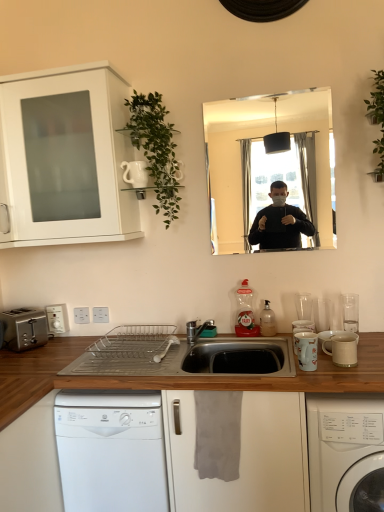
The image size is (384, 512). Identify the location of white plastic dishwasher at lower center. (111, 450).

Describe the element at coordinates (342, 349) in the screenshot. Image resolution: width=384 pixels, height=512 pixels. I see `white ceramic mug at right, the first appliance positioned from the right` at that location.

What do you see at coordinates (346, 452) in the screenshot?
I see `white glossy washing machine at lower right` at bounding box center [346, 452].

The height and width of the screenshot is (512, 384). Describe the element at coordinates (184, 376) in the screenshot. I see `wooden countertop at center, arranged as the 1th countertop when viewed from the top` at that location.

This screenshot has height=512, width=384. What are the coordinates of `clear glass mirror at upper center` in the screenshot? It's located at (268, 169).

Where is `white glossy cabinet at upper left`? The image size is (384, 512). white glossy cabinet at upper left is located at coordinates pos(65,158).

You are a GUI agent. You are given a task and a screenshot of the screen. Output one action in this format:
    pyautogui.click(x=<x>, y=<y>)
    Task: Click on the translucent plastic bottle at sink, the second bottle when ordered from right to left
    The width and height of the screenshot is (384, 512).
    Given the screenshot: What is the action you would take?
    pyautogui.click(x=245, y=312)

Locate an element on the screen. white plastic dishwasher at lower center is located at coordinates (111, 450).

Considering the positions of objects wooden countertop at center, arranged as the 1th countertop when viewed from the top, and white ceramic mug at right, which is the 2th appliance in front-to-back order, in the image provided, who is more to the right, wooden countertop at center, arranged as the 1th countertop when viewed from the top, or white ceramic mug at right, which is the 2th appliance in front-to-back order,?

white ceramic mug at right, which is the 2th appliance in front-to-back order, is more to the right.

From the picture: From the image's perspective, is wooden countertop at center, the 2th countertop ordered from the bottom, located above white ceramic mug at right, arranged as the 3th appliance when viewed from the top?

Incorrect, from the image's perspective, wooden countertop at center, the 2th countertop ordered from the bottom, is lower than white ceramic mug at right, arranged as the 3th appliance when viewed from the top.

Is wooden countertop at center, the 2th countertop ordered from the bottom, located outside white ceramic mug at right, the 3th appliance viewed from the left?

Yes, wooden countertop at center, the 2th countertop ordered from the bottom, is located beyond the bounds of white ceramic mug at right, the 3th appliance viewed from the left.

How much distance is there between wooden countertop at center, the 2th countertop ordered from the bottom, and translucent plastic bottle at sink, marked as the 1th bottle in a left-to-right arrangement?

26.27 inches.

From the picture: From the image's perspective, is wooden countertop at center, the 2th countertop ordered from the bottom, located above or below translucent plastic bottle at sink, the second bottle when ordered from right to left?

wooden countertop at center, the 2th countertop ordered from the bottom, is situated lower than translucent plastic bottle at sink, the second bottle when ordered from right to left, in the image.

Which object is closer to the camera, wooden countertop at center, the 2th countertop ordered from the bottom, or translucent plastic bottle at sink, marked as the 1th bottle in a left-to-right arrangement?

wooden countertop at center, the 2th countertop ordered from the bottom, is closer to the camera.

Would you consider wooden countertop at center, arranged as the 1th countertop when viewed from the top, to be distant from translucent plastic bottle at sink, marked as the 1th bottle in a left-to-right arrangement?

wooden countertop at center, arranged as the 1th countertop when viewed from the top, is near translucent plastic bottle at sink, marked as the 1th bottle in a left-to-right arrangement, not far away.

Who is bigger, white ceramic pitcher at upper left, placed as the first appliance when sorted from left to right, or white glossy mug at right, which appears as the 2th appliance when viewed from the right?

With larger size is white ceramic pitcher at upper left, placed as the first appliance when sorted from left to right.

Where is `appliance that appears above the white glossy mug at right, arranged as the second appliance when viewed from the top (from the image's perspective)`? The width and height of the screenshot is (384, 512). appliance that appears above the white glossy mug at right, arranged as the second appliance when viewed from the top (from the image's perspective) is located at coordinates (135, 173).

Does white plastic dishwasher at lower center lie behind translucent plastic soap dispenser at sink, which is counted as the 1th bottle, starting from the right?

No, white plastic dishwasher at lower center is closer to the viewer.

At what (x,y) coordinates should I click in order to perform the action: click on bottle that is the 1st one above the white plastic dishwasher at lower center (from a real-world perspective). Please return your answer as a coordinate pair (x, y). The width and height of the screenshot is (384, 512). Looking at the image, I should click on (267, 320).

Visually, is white plastic dishwasher at lower center positioned to the left or to the right of translucent plastic soap dispenser at sink, which is the 2th bottle from left to right?

white plastic dishwasher at lower center is to the left of translucent plastic soap dispenser at sink, which is the 2th bottle from left to right.

Considering the relative sizes of wooden at lower center, which ranks as the 1th countertop in bottom-to-top order, and white plastic dishwasher at lower center in the image provided, is wooden at lower center, which ranks as the 1th countertop in bottom-to-top order, taller than white plastic dishwasher at lower center?

Correct, wooden at lower center, which ranks as the 1th countertop in bottom-to-top order, is much taller as white plastic dishwasher at lower center.

Is white plastic dishwasher at lower center at the back of wooden at lower center, which ranks as the 1th countertop in bottom-to-top order?

Yes.

Considering the relative positions of wooden at lower center, the second countertop viewed from the top, and white plastic dishwasher at lower center in the image provided, is wooden at lower center, the second countertop viewed from the top, to the right of white plastic dishwasher at lower center from the viewer's perspective?

Correct, you'll find wooden at lower center, the second countertop viewed from the top, to the right of white plastic dishwasher at lower center.

Considering the relative positions of white ceramic pitcher at upper left, positioned as the third appliance in bottom-to-top order, and green leafy plant at upper left in the image provided, is white ceramic pitcher at upper left, positioned as the third appliance in bottom-to-top order, to the left of green leafy plant at upper left from the viewer's perspective?

Correct, you'll find white ceramic pitcher at upper left, positioned as the third appliance in bottom-to-top order, to the left of green leafy plant at upper left.

Looking at their sizes, would you say white ceramic pitcher at upper left, arranged as the third appliance when viewed from the right, is wider or thinner than green leafy plant at upper left?

Clearly, white ceramic pitcher at upper left, arranged as the third appliance when viewed from the right, has less width compared to green leafy plant at upper left.

Is white ceramic pitcher at upper left, arranged as the third appliance when viewed from the right, inside the boundaries of green leafy plant at upper left, or outside?

white ceramic pitcher at upper left, arranged as the third appliance when viewed from the right, can be found inside green leafy plant at upper left.

Considering the relative positions of white ceramic pitcher at upper left, arranged as the third appliance when viewed from the right, and green leafy plant at upper left in the image provided, is white ceramic pitcher at upper left, arranged as the third appliance when viewed from the right, in front of green leafy plant at upper left?

No, white ceramic pitcher at upper left, arranged as the third appliance when viewed from the right, is further to the viewer.

Considering the relative positions of silver metallic toaster at lower left and clear glass mirror at upper center in the image provided, is silver metallic toaster at lower left to the left of clear glass mirror at upper center from the viewer's perspective?

Indeed, silver metallic toaster at lower left is positioned on the left side of clear glass mirror at upper center.

Is silver metallic toaster at lower left far away from clear glass mirror at upper center?

Yes.

Could you tell me if silver metallic toaster at lower left is facing clear glass mirror at upper center?

No, silver metallic toaster at lower left is not facing towards clear glass mirror at upper center.

Considering the relative sizes of silver metallic toaster at lower left and clear glass mirror at upper center in the image provided, is silver metallic toaster at lower left thinner than clear glass mirror at upper center?

No, silver metallic toaster at lower left is not thinner than clear glass mirror at upper center.

There is a wooden countertop at center, the 2th countertop ordered from the bottom. Where is `the 1st appliance above it (from the image's perspective)`? the 1st appliance above it (from the image's perspective) is located at coordinates (342, 349).

This screenshot has height=512, width=384. I want to click on the 1st bottle to the right of the wooden countertop at center, the 2th countertop ordered from the bottom, starting your count from the anchor, so click(245, 312).

Estimate the real-world distances between objects in this image. Which object is further from white ceramic pitcher at upper left, placed as the first appliance when sorted from left to right, translucent plastic soap dispenser at sink, which is the 2th bottle from left to right, or white glossy cabinet at upper left?

translucent plastic soap dispenser at sink, which is the 2th bottle from left to right, lies further to white ceramic pitcher at upper left, placed as the first appliance when sorted from left to right, than the other object.

Considering their positions, is white glossy mug at right, the first appliance viewed from the front, positioned further to green leafy plant at upper left than white glossy washing machine at lower right?

white glossy washing machine at lower right is further to green leafy plant at upper left.

Which object lies nearer to the anchor point white ceramic pitcher at upper left, arranged as the 1th appliance when viewed from the top, white plastic dishwasher at lower center or white glossy cabinet at upper left?

white glossy cabinet at upper left lies closer to white ceramic pitcher at upper left, arranged as the 1th appliance when viewed from the top, than the other object.

Looking at the image, which one is located closer to translucent plastic soap dispenser at sink, which is counted as the 1th bottle, starting from the right, silver metallic toaster at lower left or white glossy cabinet at upper left?

white glossy cabinet at upper left.

In the scene shown: Which object lies further to the anchor point white glossy mug at right, which appears as the 2th appliance when viewed from the right, green leafy plant at upper left or silver metallic toaster at lower left?

silver metallic toaster at lower left is further to white glossy mug at right, which appears as the 2th appliance when viewed from the right.

Considering their positions, is white plastic dishwasher at lower center positioned closer to translucent plastic bottle at sink, the second bottle when ordered from right to left, than clear glass mirror at upper center?

The object closer to translucent plastic bottle at sink, the second bottle when ordered from right to left, is white plastic dishwasher at lower center.

When comparing their distances from green leafy plant at upper left, does wooden at lower center, which ranks as the 1th countertop in bottom-to-top order, or white ceramic mug at right, arranged as the 3th appliance when viewed from the top, seem closer?

Among the two, wooden at lower center, which ranks as the 1th countertop in bottom-to-top order, is located nearer to green leafy plant at upper left.

From the image, which object appears to be farther from wooden countertop at center, arranged as the 1th countertop when viewed from the top, green leafy plant at upper right or white glossy cabinet at upper left?

green leafy plant at upper right is further to wooden countertop at center, arranged as the 1th countertop when viewed from the top.

Locate an element on the screen. This screenshot has width=384, height=512. mirror situated between silver metallic toaster at lower left and green leafy plant at upper right from left to right is located at coordinates (268, 169).

At what (x,y) coordinates should I click in order to perform the action: click on houseplant that lies between green leafy plant at upper right and white plastic dishwasher at lower center from top to bottom. Please return your answer as a coordinate pair (x, y). The height and width of the screenshot is (512, 384). Looking at the image, I should click on (156, 149).

In order to click on home appliance between silver metallic toaster at lower left and white glossy mug at right, the second appliance from the bottom in this screenshot , I will do `click(111, 450)`.

This screenshot has width=384, height=512. Identify the location of home appliance between silver metallic toaster at lower left and wooden at lower center, which ranks as the 1th countertop in bottom-to-top order, from left to right. (111, 450).